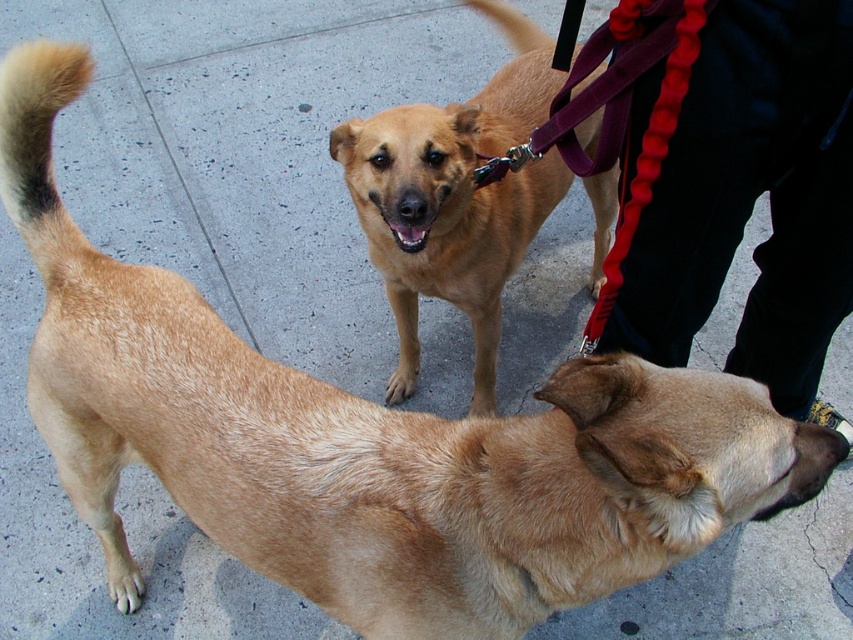
Which is in front, point (508, 35) or point (3, 189)?

Point (3, 189) is in front.

Measure the distance between golden fur dog at center and brown fur tail at upper left.

golden fur dog at center and brown fur tail at upper left are 91.12 centimeters apart from each other.

Image resolution: width=853 pixels, height=640 pixels. Describe the element at coordinates (456, 198) in the screenshot. I see `golden fur dog at center` at that location.

At what (x,y) coordinates should I click in order to perform the action: click on golden fur dog at center. Please return your answer as a coordinate pair (x, y). This screenshot has height=640, width=853. Looking at the image, I should click on (456, 198).